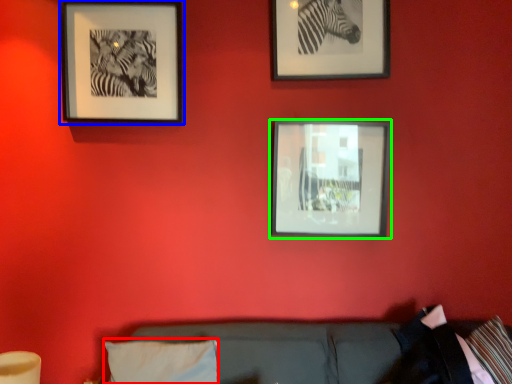
Question: Estimate the real-world distances between objects in this image. Which object is farther from pillow (highlighted by a red box), picture frame (highlighted by a blue box) or picture frame (highlighted by a green box)?

Choices:
 (A) picture frame
 (B) picture frame

Answer: (A)